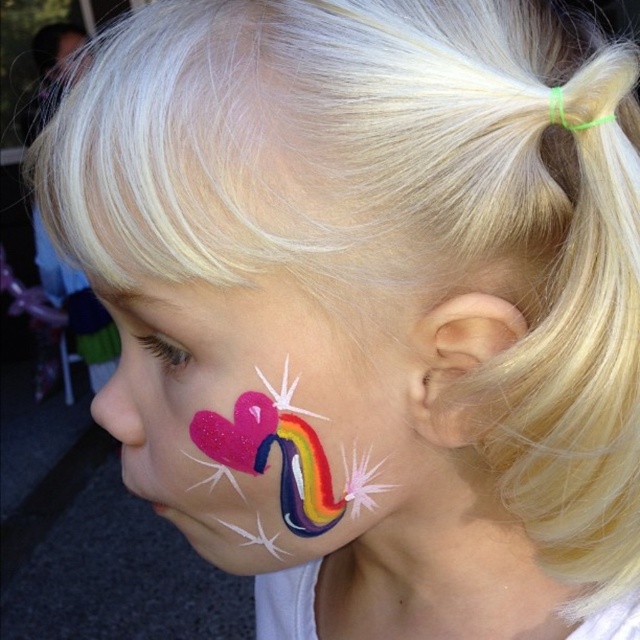
Does pink matte ear at right have a greater height compared to matte pink heart at lower left?

Incorrect, pink matte ear at right's height is not larger of matte pink heart at lower left's.

Is pink matte ear at right wider than matte pink heart at lower left?

No, pink matte ear at right is not wider than matte pink heart at lower left.

The image size is (640, 640). What do you see at coordinates (456, 365) in the screenshot?
I see `pink matte ear at right` at bounding box center [456, 365].

Image resolution: width=640 pixels, height=640 pixels. Identify the location of pink matte ear at right. (456, 365).

Which is behind, point (140, 307) or point (268, 540)?

Positioned behind is point (268, 540).

Is point (177, 467) closer to viewer compared to point (285, 448)?

No, it is behind (285, 448).

Locate an element on the screen. This screenshot has width=640, height=640. shiny pink heart at left is located at coordinates (252, 420).

The height and width of the screenshot is (640, 640). What do you see at coordinates (282, 456) in the screenshot?
I see `shiny rainbow heart at lower left` at bounding box center [282, 456].

Is point (284, 436) farther from viewer compared to point (93, 408)?

No, (284, 436) is closer to viewer.

Does point (307, 477) come in front of point (115, 403)?

Yes.

Where is `shiny rainbow heart at lower left`? The image size is (640, 640). shiny rainbow heart at lower left is located at coordinates (282, 456).